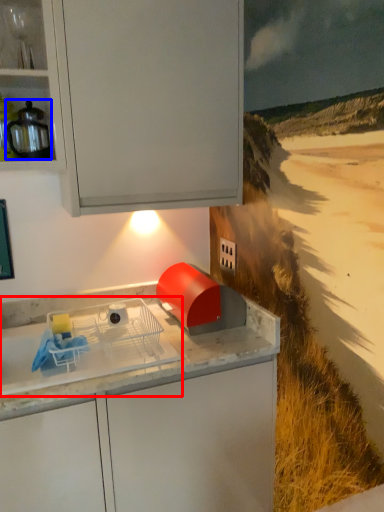
Question: Which point is closer to the camera, home appliance (highlighted by a red box) or kitchen appliance (highlighted by a blue box)?

Choices:
 (A) home appliance
 (B) kitchen appliance

Answer: (A)